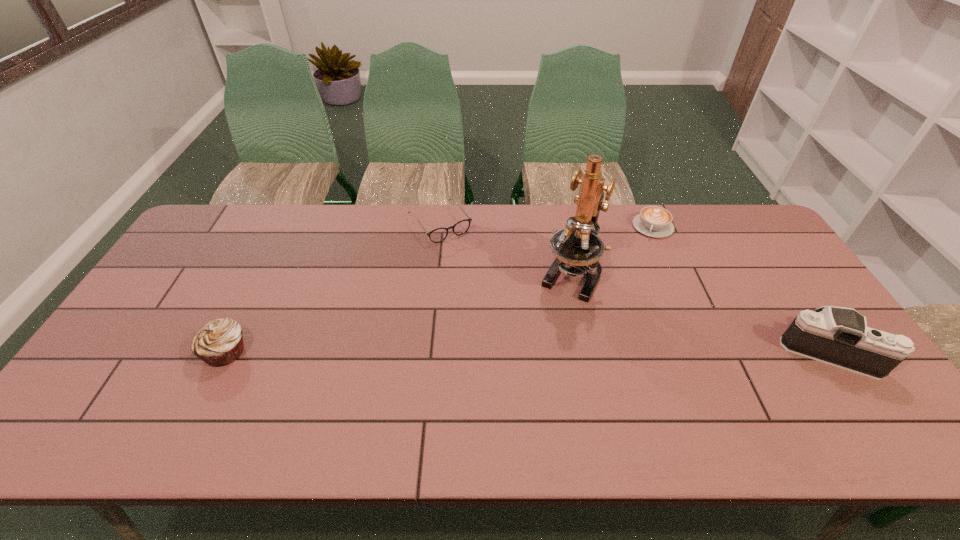
Where is `the leftmost object`? The height and width of the screenshot is (540, 960). the leftmost object is located at coordinates (220, 342).

I want to click on the third tallest object, so click(x=220, y=342).

Where is `the second tallest object`? The height and width of the screenshot is (540, 960). the second tallest object is located at coordinates (838, 336).

I want to click on camera, so click(x=838, y=336).

The image size is (960, 540). I want to click on the third object from left to right, so click(x=577, y=248).

At what (x,y) coordinates should I click in order to perform the action: click on the third farthest object. Please return your answer as a coordinate pair (x, y). Looking at the image, I should click on (577, 248).

You are a GUI agent. You are given a task and a screenshot of the screen. Output one action in this format:
    pyautogui.click(x=<x>, y=<y>)
    Task: Click on the spectacles
    This screenshot has height=540, width=960.
    Given the screenshot: What is the action you would take?
    pyautogui.click(x=437, y=235)

Find the location of a particular element. This screenshot has width=960, height=540. the second object from right to left is located at coordinates (653, 221).

Identify the location of vacant space situated 0.320m on the right of the third shortest object. point(372,352).

Locate an element on the screen. vacant region located 0.080m on the left of the second tallest object is located at coordinates (753, 351).